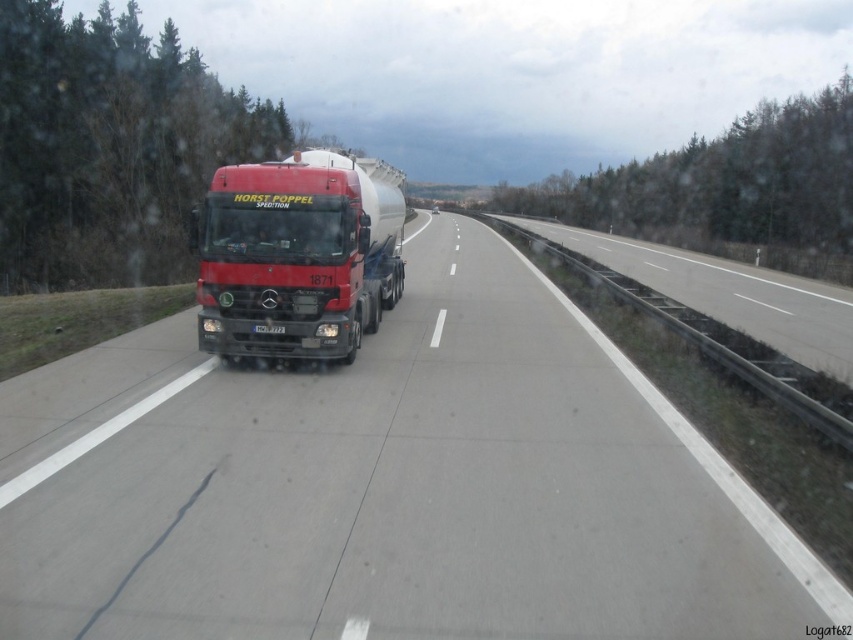
Who is lower down, metallic truck at center or metallic silver tank at center?

Positioned lower is metallic truck at center.

Who is more forward, (709, 490) or (383, 305)?

Point (709, 490) is more forward.

Identify the location of metallic truck at center. This screenshot has width=853, height=640. (387, 484).